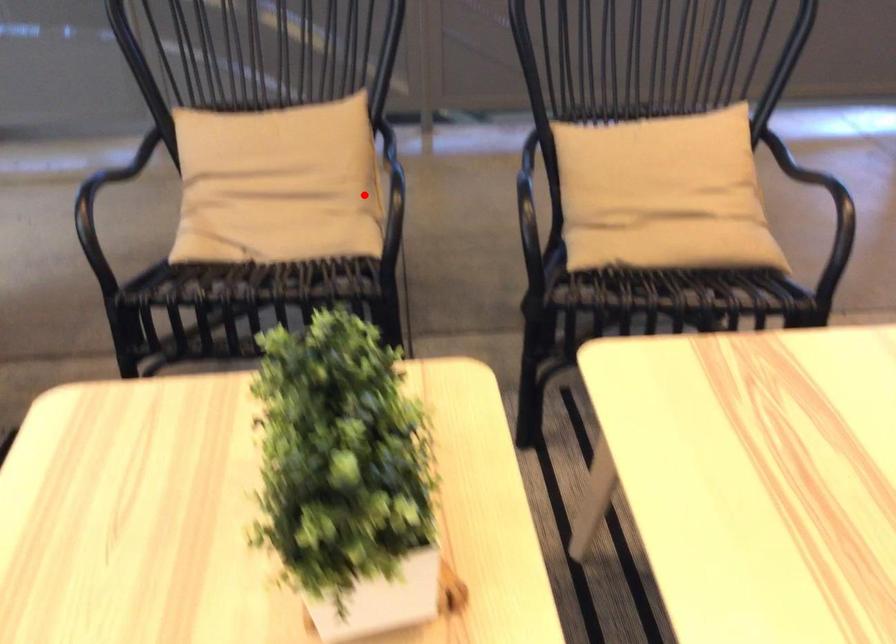
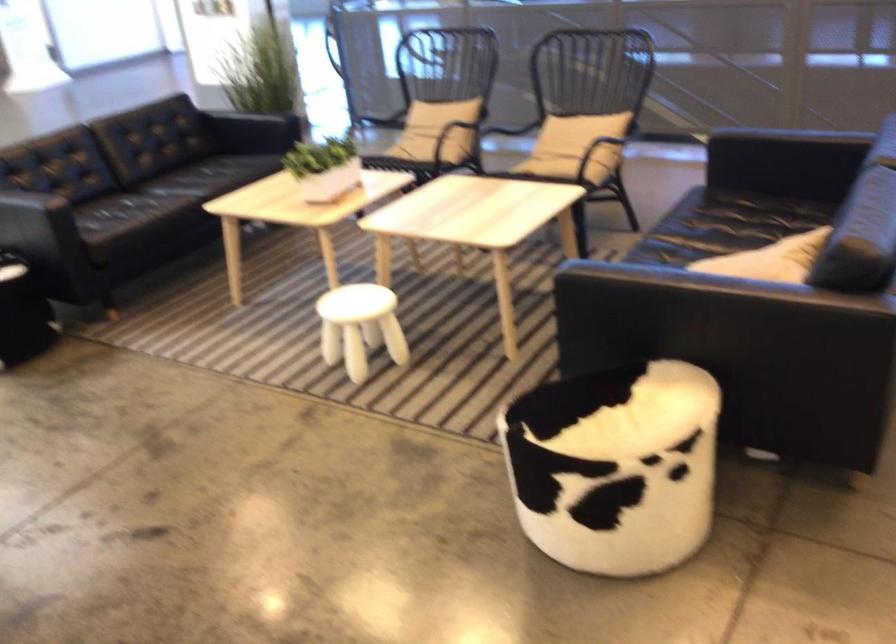
Question: I am providing you with two images of the same scene from different viewpoints. A red point is shown in image1. For the corresponding object point in image2, is it positioned nearer or farther from the camera?

Choices:
 (A) Nearer
 (B) Farther

Answer: (B)